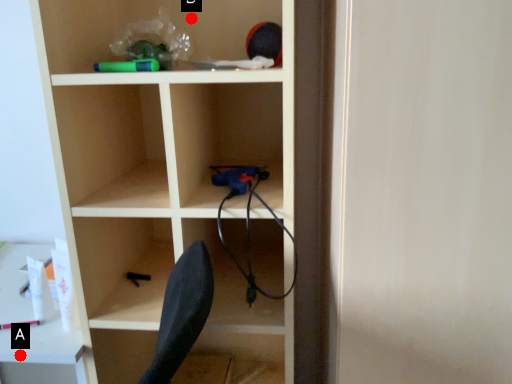
Question: Two points are circled on the image, labeled by A and B beside each circle. Which point is closer to the camera taking this photo?

Choices:
 (A) A is closer
 (B) B is closer

Answer: (A)